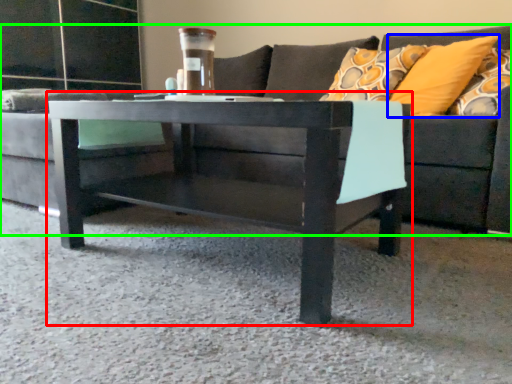
Question: Which object is positioned farthest from coffee table (highlighted by a red box)? Select from pillow (highlighted by a blue box) and studio couch (highlighted by a green box).

Choices:
 (A) pillow
 (B) studio couch

Answer: (B)